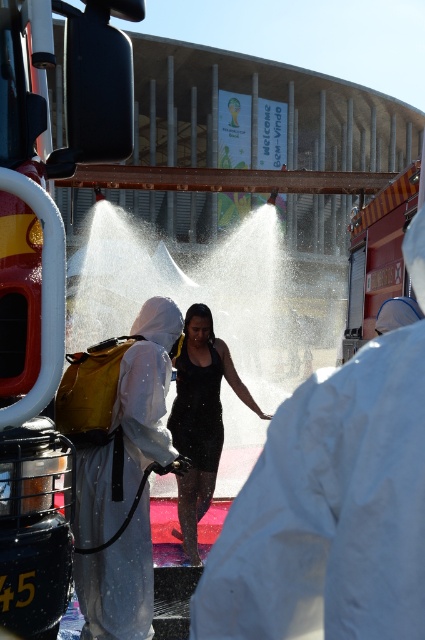
Question: Which point is closer to the camera?

Choices:
 (A) (190, 428)
 (B) (85, 157)
 (C) (124, 435)

Answer: (B)

Question: Is yellow metallic fire truck at left in front of black matte dress at center?

Choices:
 (A) no
 (B) yes

Answer: (B)

Question: Is yellow metallic fire truck at left bigger than white protective suit at center?

Choices:
 (A) no
 (B) yes

Answer: (B)

Question: Which point is farther from the camera taking this photo?

Choices:
 (A) (36, 509)
 (B) (132, 445)

Answer: (B)

Question: Is yellow metallic fire truck at left smaller than black matte dress at center?

Choices:
 (A) yes
 (B) no

Answer: (A)

Question: Which point appears farthest from the camera in this image?

Choices:
 (A) (95, 525)
 (B) (85, 20)

Answer: (A)